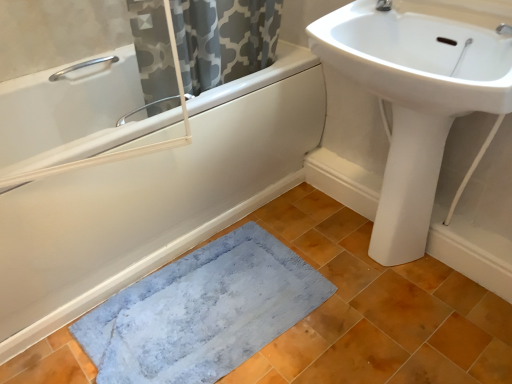
Question: Does silver metallic grab bar at upper left have a larger size compared to white matte bathtub at lower left?

Choices:
 (A) yes
 (B) no

Answer: (B)

Question: Is silver metallic grab bar at upper left in front of white matte bathtub at lower left?

Choices:
 (A) yes
 (B) no

Answer: (B)

Question: Is silver metallic grab bar at upper left taller than white matte bathtub at lower left?

Choices:
 (A) no
 (B) yes

Answer: (A)

Question: Does silver metallic grab bar at upper left have a lesser height compared to white matte bathtub at lower left?

Choices:
 (A) yes
 (B) no

Answer: (A)

Question: Can you confirm if silver metallic grab bar at upper left is thinner than white matte bathtub at lower left?

Choices:
 (A) no
 (B) yes

Answer: (B)

Question: Considering their positions, is white matte bathtub at lower left located in front of or behind white glossy bidet at lower right?

Choices:
 (A) front
 (B) behind

Answer: (A)

Question: From their relative heights in the image, would you say white matte bathtub at lower left is taller or shorter than white glossy bidet at lower right?

Choices:
 (A) tall
 (B) short

Answer: (B)

Question: Is point (261, 104) closer or farther from the camera than point (430, 213)?

Choices:
 (A) closer
 (B) farther

Answer: (B)

Question: Is white matte bathtub at lower left inside the boundaries of white glossy bidet at lower right, or outside?

Choices:
 (A) outside
 (B) inside

Answer: (A)

Question: From the image's perspective, is white glossy sink at upper right positioned above or below blue soft rug at lower left?

Choices:
 (A) below
 (B) above

Answer: (B)

Question: Would you say white glossy sink at upper right is inside or outside blue soft rug at lower left?

Choices:
 (A) outside
 (B) inside

Answer: (A)

Question: From a real-world perspective, relative to blue soft rug at lower left, is white glossy sink at upper right vertically above or below?

Choices:
 (A) below
 (B) above

Answer: (B)

Question: Is point (399, 66) positioned closer to the camera than point (151, 304)?

Choices:
 (A) farther
 (B) closer

Answer: (B)

Question: From their relative heights in the image, would you say white matte bathtub at lower left is taller or shorter than white glossy sink at upper right?

Choices:
 (A) tall
 (B) short

Answer: (A)

Question: In the image, is white matte bathtub at lower left on the left side or the right side of white glossy sink at upper right?

Choices:
 (A) right
 (B) left

Answer: (B)